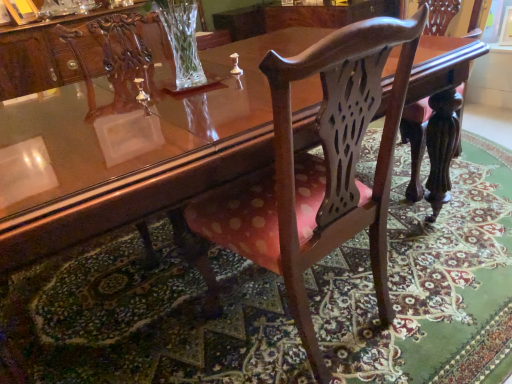
Identify the location of polka dot fabric chair at center. (320, 168).

Image resolution: width=512 pixels, height=384 pixels. What do you see at coordinates (320, 168) in the screenshot? I see `polka dot fabric chair at center` at bounding box center [320, 168].

Locate an element on the screen. pink fabric chair at center is located at coordinates (145, 319).

What do you see at coordinates (145, 319) in the screenshot? I see `pink fabric chair at center` at bounding box center [145, 319].

What is the approximate height of pink fabric chair at center?

The height of pink fabric chair at center is 2.42 inches.

I want to click on polka dot fabric chair at center, so click(x=320, y=168).

Which is more to the left, pink fabric chair at center or polka dot fabric chair at center?

polka dot fabric chair at center.

Which object is closer to the camera, pink fabric chair at center or polka dot fabric chair at center?

polka dot fabric chair at center is closer to the camera.

Does point (251, 274) come behind point (384, 324)?

Yes, it is behind point (384, 324).

From the image's perspective, does pink fabric chair at center appear lower than polka dot fabric chair at center?

Yes.

From a real-world perspective, is pink fabric chair at center above or below polka dot fabric chair at center?

pink fabric chair at center is below polka dot fabric chair at center.

In the scene shown: Considering the sizes of pink fabric chair at center and polka dot fabric chair at center in the image, is pink fabric chair at center wider or thinner than polka dot fabric chair at center?

Considering their sizes, pink fabric chair at center looks broader than polka dot fabric chair at center.

Consider the image. Which of these two, pink fabric chair at center or polka dot fabric chair at center, stands taller?

Standing taller between the two is polka dot fabric chair at center.

Is pink fabric chair at center smaller than polka dot fabric chair at center?

Result: Yes, pink fabric chair at center is smaller than polka dot fabric chair at center.

Is pink fabric chair at center inside or outside of polka dot fabric chair at center?

pink fabric chair at center is not enclosed by polka dot fabric chair at center.

Consider the image. Would you say pink fabric chair at center is a long distance from polka dot fabric chair at center?

They are positioned close to each other.

Is pink fabric chair at center facing towards polka dot fabric chair at center?

No, pink fabric chair at center is not oriented towards polka dot fabric chair at center.

How different are the orientations of pink fabric chair at center and polka dot fabric chair at center in degrees?

pink fabric chair at center and polka dot fabric chair at center are facing 5.16 degrees away from each other.

Measure the distance from pink fabric chair at center to polka dot fabric chair at center.

They are 21.56 inches apart.

Identify the location of mat to the right of polka dot fabric chair at center. Image resolution: width=512 pixels, height=384 pixels. [x=145, y=319].

Does polka dot fabric chair at center appear on the right side of pink fabric chair at center?

Incorrect, polka dot fabric chair at center is not on the right side of pink fabric chair at center.

Considering the relative positions of polka dot fabric chair at center and pink fabric chair at center in the image provided, is polka dot fabric chair at center behind pink fabric chair at center?

No, polka dot fabric chair at center is closer to the camera.

Is point (384, 250) less distant than point (71, 260)?

Yes.

From the image's perspective, which one is positioned higher, polka dot fabric chair at center or pink fabric chair at center?

polka dot fabric chair at center, from the image's perspective.

From a real-world perspective, does polka dot fabric chair at center stand above pink fabric chair at center?

Yes.

In the scene shown: Between polka dot fabric chair at center and pink fabric chair at center, which one has larger width?

pink fabric chair at center is wider.

Consider the image. Considering the relative sizes of polka dot fabric chair at center and pink fabric chair at center in the image provided, is polka dot fabric chair at center shorter than pink fabric chair at center?

Incorrect, the height of polka dot fabric chair at center does not fall short of that of pink fabric chair at center.

Based on their sizes in the image, would you say polka dot fabric chair at center is bigger or smaller than pink fabric chair at center?

In the image, polka dot fabric chair at center appears to be larger than pink fabric chair at center.

Is pink fabric chair at center surrounded by polka dot fabric chair at center?

No, pink fabric chair at center is not inside polka dot fabric chair at center.

From the picture: Is polka dot fabric chair at center far away from pink fabric chair at center?

No, there isn't a large distance between polka dot fabric chair at center and pink fabric chair at center.

Is pink fabric chair at center at the back of polka dot fabric chair at center?

No, polka dot fabric chair at center is not facing away from pink fabric chair at center.

How different are the orientations of polka dot fabric chair at center and pink fabric chair at center in degrees?

polka dot fabric chair at center and pink fabric chair at center are facing 5.16 degrees away from each other.

Find the location of `mat below the polka dot fabric chair at center (from the image's perspective)`. mat below the polka dot fabric chair at center (from the image's perspective) is located at coordinates (145, 319).

Where is `mat on the right of polka dot fabric chair at center`? mat on the right of polka dot fabric chair at center is located at coordinates (145, 319).

Locate an element on the screen. The width and height of the screenshot is (512, 384). mat below the polka dot fabric chair at center (from the image's perspective) is located at coordinates (145, 319).